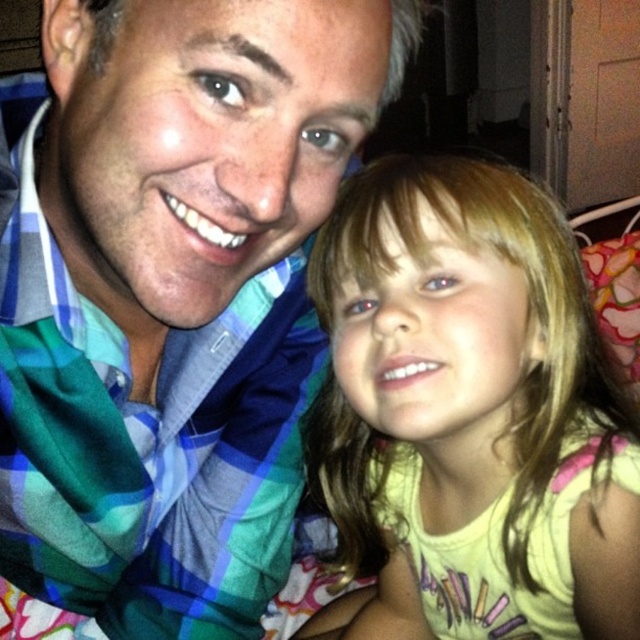
Question: Which object appears farthest from the camera in this image?

Choices:
 (A) yellow cotton shirt at center
 (B) blue plaid shirt at center

Answer: (A)

Question: In this image, where is blue plaid shirt at center located relative to yellow cotton shirt at center?

Choices:
 (A) above
 (B) below

Answer: (A)

Question: Which object is closer to the camera taking this photo?

Choices:
 (A) blue plaid shirt at center
 (B) yellow cotton shirt at center

Answer: (A)

Question: Is blue plaid shirt at center further to camera compared to yellow cotton shirt at center?

Choices:
 (A) yes
 (B) no

Answer: (B)

Question: Does blue plaid shirt at center have a larger size compared to yellow cotton shirt at center?

Choices:
 (A) no
 (B) yes

Answer: (B)